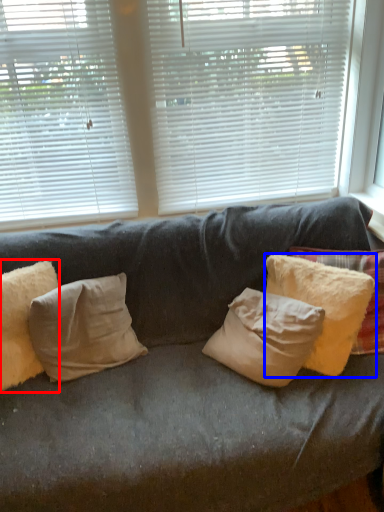
Question: Which point is closer to the camera, pillow (highlighted by a red box) or pillow (highlighted by a blue box)?

Choices:
 (A) pillow
 (B) pillow

Answer: (A)